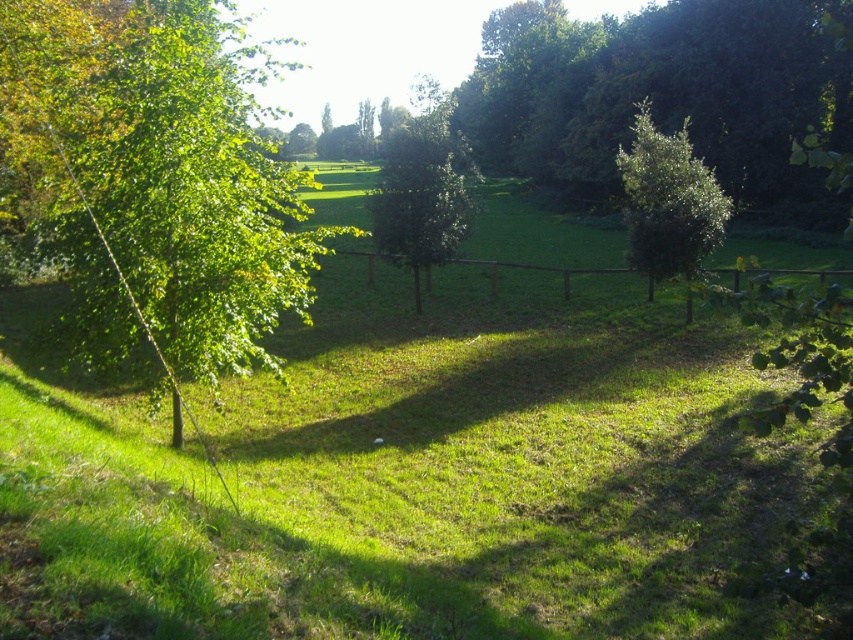
Looking at this image, is the position of green leafy tree at left less distant than that of green leafy tree at right?

That is True.

Which is below, green leafy tree at left or green leafy tree at right?

green leafy tree at right

Is point (202, 38) behind point (695, 170)?

No, it is in front of (695, 170).

This screenshot has width=853, height=640. Find the location of `green leafy tree at left`. green leafy tree at left is located at coordinates (187, 196).

Who is more forward, (637,134) or (415,240)?

Positioned in front is point (415,240).

Is point (637, 163) positioned in front of point (430, 244)?

No.

Who is more forward, [637,168] or [422,100]?

Point [637,168]

What are the coordinates of `green leafy tree at right` in the screenshot? It's located at (668, 202).

Who is more forward, (231, 54) or (436, 225)?

Point (231, 54)

Is green leafy tree at left thinner than green leafy tree at center?

No.

What do you see at coordinates (187, 196) in the screenshot? The width and height of the screenshot is (853, 640). I see `green leafy tree at left` at bounding box center [187, 196].

Where is `green leafy tree at left`? green leafy tree at left is located at coordinates (187, 196).